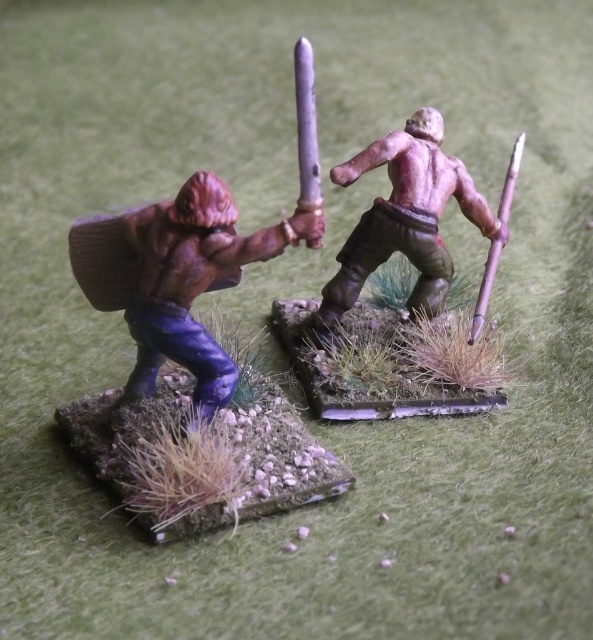
You are a collector examining two weapons in a display case. The smooth brown spear at center and the shiny silver sword at center are both displayed on a green surface. Which weapon is closer to you?

The smooth brown spear at center is closer to you because it is positioned further to the viewer than the shiny silver sword at center.

You are a collector who wants to display both the smooth brown spear at center and the shiny silver sword at center on a shelf. If the shelf has limited space, which object should you prioritize placing first to ensure both fit?

The smooth brown spear at center is larger in size than the shiny silver sword at center, so you should prioritize placing the shiny silver sword at center first to accommodate the larger spear afterward.